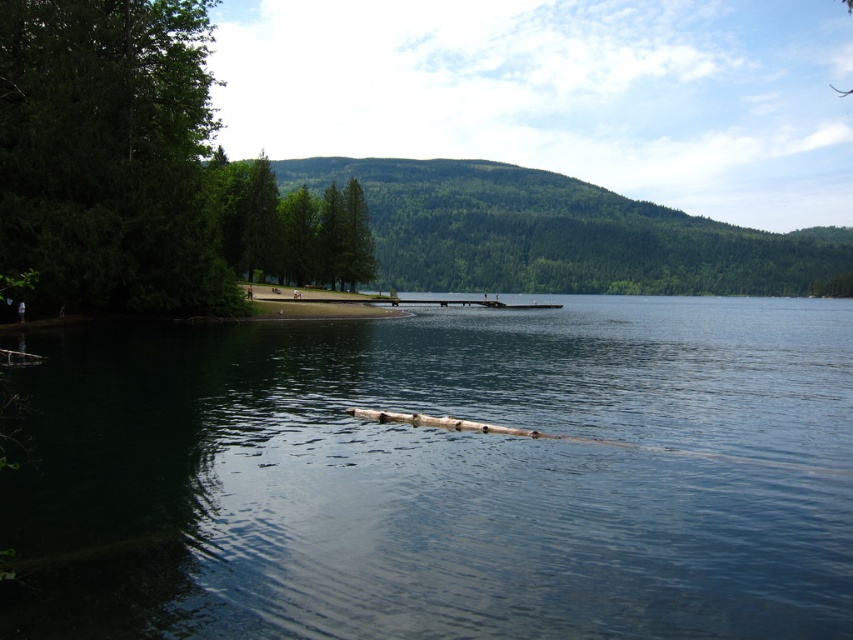
In the scene shown: You are planning to build a small boat dock on the lake. The dock needs to be placed where the clear water at center is wider than the green matte tree at center. Based on the scene description, can you confirm if this placement is possible?

The clear water at center might be wider than the green matte tree at center, so it is possible to place the dock there as the water width could accommodate the structure.